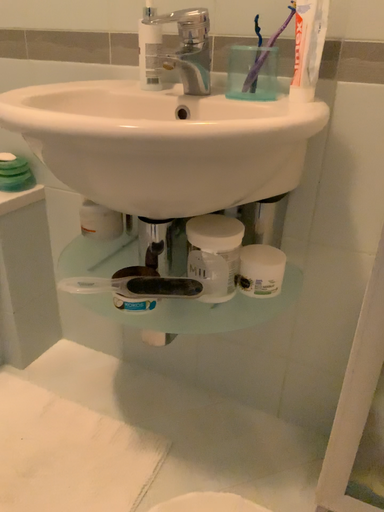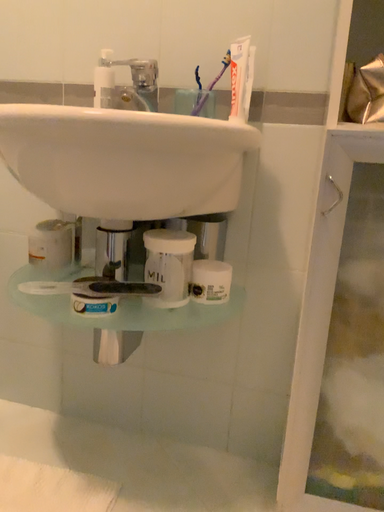
Question: Which way did the camera rotate in the video?

Choices:
 (A) rotated downward
 (B) rotated upward

Answer: (B)